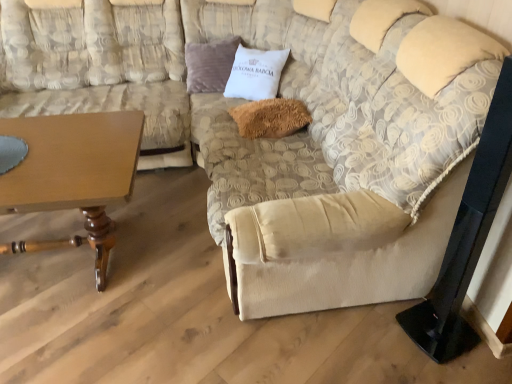
Question: In terms of height, does velvet purple pillow at upper center, the first pillow from the left, look taller or shorter compared to wooden table at lower left?

Choices:
 (A) tall
 (B) short

Answer: (B)

Question: In terms of width, does velvet purple pillow at upper center, which ranks as the 2th pillow in front-to-back order, look wider or thinner when compared to wooden table at lower left?

Choices:
 (A) wide
 (B) thin

Answer: (B)

Question: Which is nearer to the velvet purple pillow at upper center, arranged as the second pillow when ordered from the bottom?

Choices:
 (A) wooden table at lower left
 (B) fuzzy brown pillow at center, which ranks as the 1th pillow in bottom-to-top order
 (C) beige fabric couch at left

Answer: (C)

Question: Considering the real-world distances, which object is farthest from the beige fabric couch at left?

Choices:
 (A) fuzzy brown pillow at center, which is the first pillow in right-to-left order
 (B) wooden table at lower left
 (C) velvet purple pillow at upper center, which ranks as the 2th pillow in front-to-back order

Answer: (A)